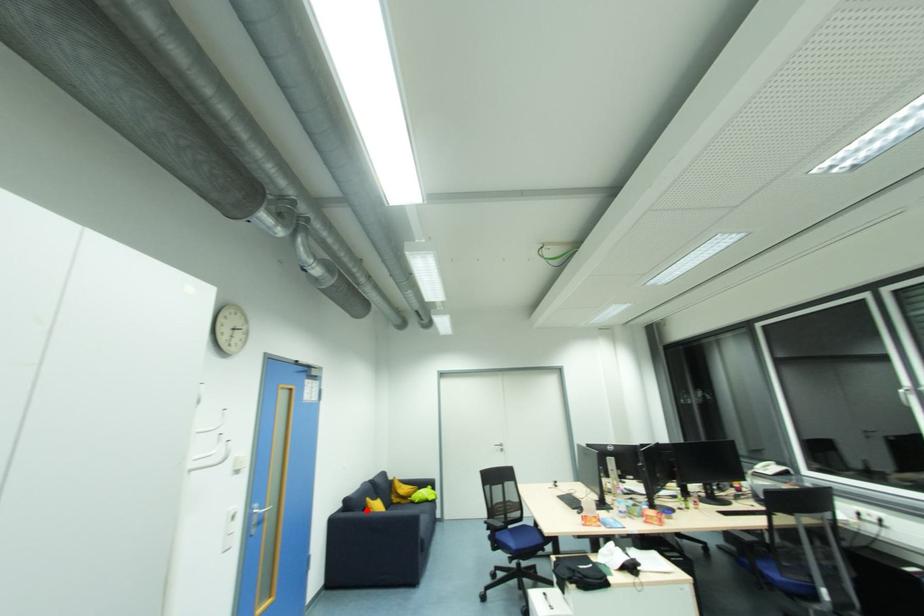
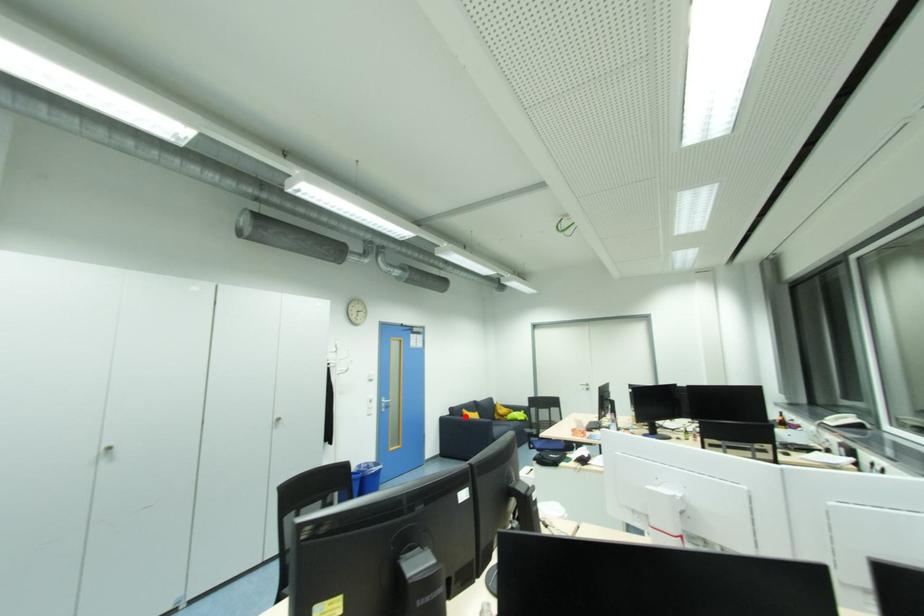
I am providing you with two images of the same scene from different viewpoints. A red point is marked on the first image and another point is marked on the second image. Is the red point in image1 aligned with the point shown in image2?

Yes